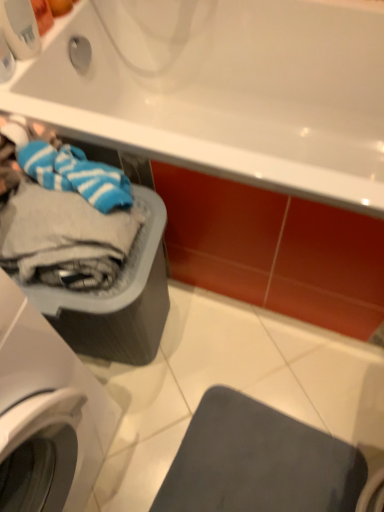
In order to face matte gray plastic basket at lower left, should I rotate leftwards or rightwards?

To align with it, rotate left about 12.360°.

Locate an element on the screen. white plastic washing machine at left is located at coordinates (48, 409).

Measure the distance between point (64, 429) and camera.

Point (64, 429) is 73.50 centimeters from camera.

The image size is (384, 512). I want to click on matte gray plastic basket at lower left, so click(x=117, y=298).

From a real-world perspective, between white plastic washing machine at left and matte gray plastic basket at lower left, who is vertically lower?

matte gray plastic basket at lower left.

What are the coordinates of `washing machine that is above the matte gray plastic basket at lower left (from a real-world perspective)` in the screenshot? It's located at (48, 409).

From the image's perspective, between white plastic washing machine at left and matte gray plastic basket at lower left, who is located below?

white plastic washing machine at left appears lower in the image.

Considering the sizes of objects white plastic washing machine at left and matte gray plastic basket at lower left in the image provided, who is smaller, white plastic washing machine at left or matte gray plastic basket at lower left?

matte gray plastic basket at lower left.

Is matte gray mat at lower right bigger or smaller than white plastic washing machine at left?

In the image, matte gray mat at lower right appears to be smaller than white plastic washing machine at left.

Considering the positions of objects matte gray mat at lower right and white plastic washing machine at left in the image provided, who is more to the left, matte gray mat at lower right or white plastic washing machine at left?

white plastic washing machine at left.

Considering the relative sizes of matte gray mat at lower right and white plastic washing machine at left in the image provided, is matte gray mat at lower right shorter than white plastic washing machine at left?

Indeed, matte gray mat at lower right has a lesser height compared to white plastic washing machine at left.

From the image's perspective, is white glossy bathtub at upper center located above or below matte gray mat at lower right?

Based on their image positions, white glossy bathtub at upper center is located above matte gray mat at lower right.

Image resolution: width=384 pixels, height=512 pixels. Find the location of `gray below the white glossy bathtub at upper center (from the image's perspective)`. gray below the white glossy bathtub at upper center (from the image's perspective) is located at coordinates (258, 462).

Which point is more distant from viewer, (329,92) or (192,490)?

The point (329,92) is more distant.

Measure the distance between white glossy bathtub at upper center and matte gray mat at lower right.

31.85 inches.

Is matte gray plastic basket at lower left at the left side of white plastic washing machine at left?

No.

From a real-world perspective, is matte gray plastic basket at lower left under white plastic washing machine at left?

Yes, from a real-world perspective, matte gray plastic basket at lower left is under white plastic washing machine at left.

How many degrees apart are the facing directions of matte gray plastic basket at lower left and white plastic washing machine at left?

The angular difference between matte gray plastic basket at lower left and white plastic washing machine at left is 8.17 degrees.

Based on the photo, is matte gray plastic basket at lower left bigger than white plastic washing machine at left?

Actually, matte gray plastic basket at lower left might be smaller than white plastic washing machine at left.

Does point (260, 501) appear closer or farther from the camera than point (371, 32)?

Point (260, 501).

Between matte gray mat at lower right and white glossy bathtub at upper center, which one is positioned behind?

matte gray mat at lower right is further from the camera.

Is matte gray mat at lower right touching white glossy bathtub at upper center?

No.

From a real-world perspective, is matte gray mat at lower right located higher than white glossy bathtub at upper center?

No.

In the image, is matte gray mat at lower right positioned in front of or behind matte gray plastic basket at lower left?

Visually, matte gray mat at lower right is located behind matte gray plastic basket at lower left.

Does matte gray mat at lower right touch matte gray plastic basket at lower left?

No, matte gray mat at lower right is not touching matte gray plastic basket at lower left.

Considering the relative sizes of matte gray mat at lower right and matte gray plastic basket at lower left in the image provided, is matte gray mat at lower right wider than matte gray plastic basket at lower left?

No, matte gray mat at lower right is not wider than matte gray plastic basket at lower left.

Is matte gray plastic basket at lower left surrounded by matte gray mat at lower right?

No, matte gray mat at lower right does not contain matte gray plastic basket at lower left.

Considering the relative sizes of white plastic washing machine at left and matte gray mat at lower right in the image provided, is white plastic washing machine at left wider than matte gray mat at lower right?

Indeed, white plastic washing machine at left has a greater width compared to matte gray mat at lower right.

From a real-world perspective, which object stands above the other?

From a 3D spatial view, white plastic washing machine at left is above.

Is white plastic washing machine at left to the right of matte gray mat at lower right from the viewer's perspective?

No, white plastic washing machine at left is not to the right of matte gray mat at lower right.

From the image's perspective, is white plastic washing machine at left located above or below matte gray mat at lower right?

From the image's perspective, white plastic washing machine at left appears above matte gray mat at lower right.

Find the location of a particular element. The image size is (384, 512). washing machine on the left side of matte gray plastic basket at lower left is located at coordinates (48, 409).

I want to click on gray on the right of white plastic washing machine at left, so click(258, 462).

Based on their spatial positions, is white glossy bathtub at upper center or matte gray mat at lower right closer to white plastic washing machine at left?

matte gray mat at lower right lies closer to white plastic washing machine at left than the other object.

Considering their positions, is white glossy bathtub at upper center positioned further to white plastic washing machine at left than matte gray plastic basket at lower left?

white glossy bathtub at upper center is further to white plastic washing machine at left.

When comparing their distances from matte gray mat at lower right, does white glossy bathtub at upper center or white plastic washing machine at left seem closer?

The object closer to matte gray mat at lower right is white plastic washing machine at left.

Considering their positions, is matte gray mat at lower right positioned further to white glossy bathtub at upper center than white plastic washing machine at left?

The object further to white glossy bathtub at upper center is matte gray mat at lower right.

Considering their positions, is white glossy bathtub at upper center positioned closer to matte gray plastic basket at lower left than matte gray mat at lower right?

matte gray mat at lower right lies closer to matte gray plastic basket at lower left than the other object.

From the image, which object appears to be farther from matte gray mat at lower right, matte gray plastic basket at lower left or white glossy bathtub at upper center?

white glossy bathtub at upper center lies further to matte gray mat at lower right than the other object.

Estimate the real-world distances between objects in this image. Which object is closer to white plastic washing machine at left, matte gray plastic basket at lower left or white glossy bathtub at upper center?

Based on the image, matte gray plastic basket at lower left appears to be nearer to white plastic washing machine at left.

Looking at the image, which one is located closer to matte gray plastic basket at lower left, white plastic washing machine at left or white glossy bathtub at upper center?

white plastic washing machine at left lies closer to matte gray plastic basket at lower left than the other object.

What are the coordinates of `dish washer between white glossy bathtub at upper center and white plastic washing machine at left vertically` in the screenshot? It's located at pyautogui.click(x=117, y=298).

Locate an element on the screen. This screenshot has width=384, height=512. washing machine between white glossy bathtub at upper center and matte gray mat at lower right in the vertical direction is located at coordinates (48, 409).

Locate an element on the screen. The image size is (384, 512). dish washer between white plastic washing machine at left and matte gray mat at lower right along the z-axis is located at coordinates (117, 298).

Identify the location of dish washer between white glossy bathtub at upper center and matte gray mat at lower right from top to bottom. (117, 298).